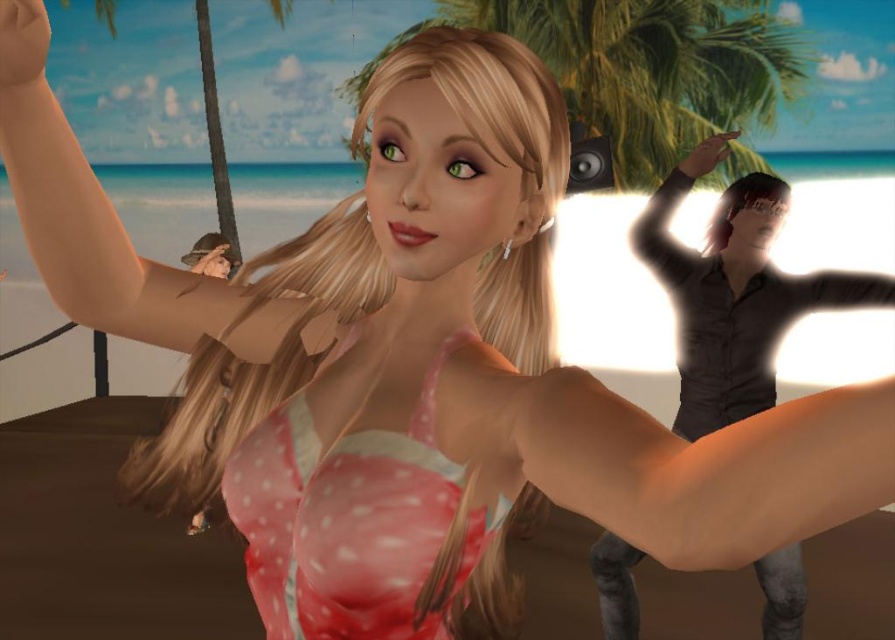
Question: Which object appears closest to the camera in this image?

Choices:
 (A) green leafy palm tree at upper center
 (B) pink polka dot fabric dress at center

Answer: (B)

Question: Which point appears closest to the camera in this image?

Choices:
 (A) (561, 58)
 (B) (354, 576)

Answer: (B)

Question: Can you confirm if pink polka dot fabric dress at center is positioned to the right of green leafy palm tree at upper center?

Choices:
 (A) yes
 (B) no

Answer: (B)

Question: Observing the image, what is the correct spatial positioning of pink polka dot fabric dress at center in reference to green leafy palm tree at upper center?

Choices:
 (A) right
 (B) left

Answer: (B)

Question: Observing the image, what is the correct spatial positioning of pink polka dot fabric dress at center in reference to green leafy palm tree at upper center?

Choices:
 (A) right
 (B) left

Answer: (B)